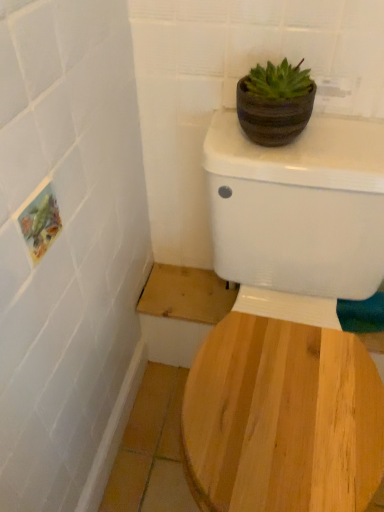
Where is `free region on the left part of brown striped pot at upper right`? free region on the left part of brown striped pot at upper right is located at coordinates (225, 137).